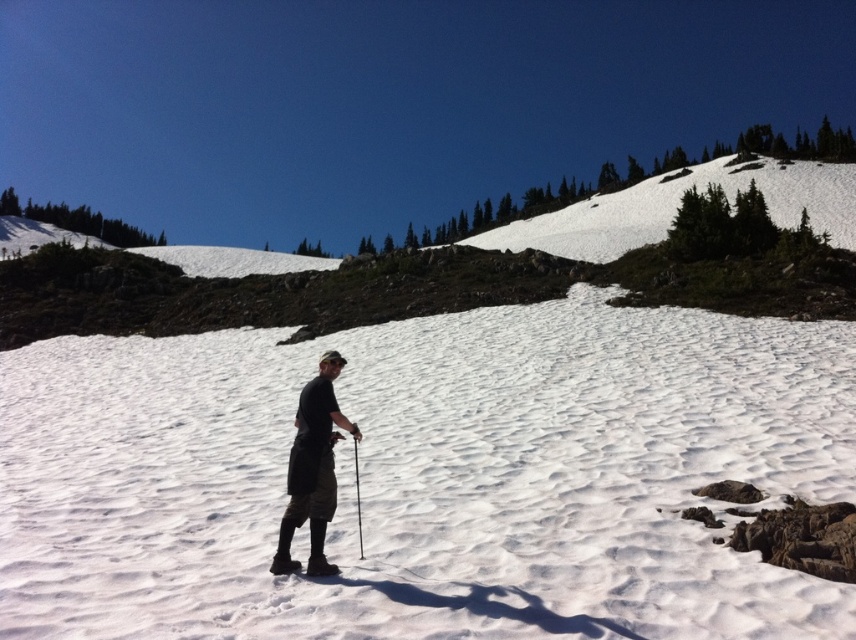
Who is shorter, dark gray fabric shorts at center or metallic silver ski pole at center?

With less height is metallic silver ski pole at center.

Is dark gray fabric shorts at center taller than metallic silver ski pole at center?

Indeed, dark gray fabric shorts at center has a greater height compared to metallic silver ski pole at center.

Between point (336, 566) and point (361, 534), which one is positioned in front?

Point (336, 566)

Where is `dark gray fabric shorts at center`? The width and height of the screenshot is (856, 640). dark gray fabric shorts at center is located at coordinates point(312,468).

Is white fluffy snow at center wider than metallic silver ski pole at center?

Correct, the width of white fluffy snow at center exceeds that of metallic silver ski pole at center.

Who is more distant from viewer, (169,368) or (355,509)?

The point (169,368) is more distant.

The image size is (856, 640). I want to click on white fluffy snow at center, so click(425, 477).

Who is more forward, (x=837, y=394) or (x=334, y=474)?

Point (x=334, y=474) is more forward.

The image size is (856, 640). What are the coordinates of `white fluffy snow at center` in the screenshot? It's located at (425, 477).